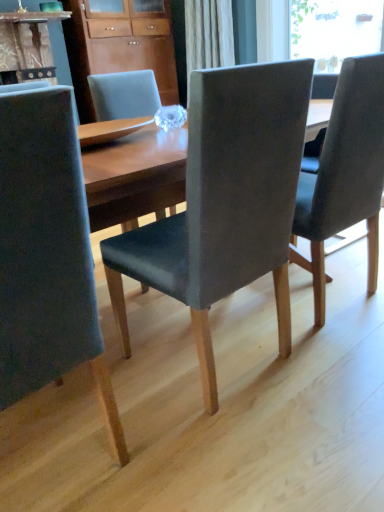
The image size is (384, 512). What are the coordinates of `free space to the back side of matte gray chair at center, acting as the second chair starting from the left` in the screenshot? It's located at (188, 313).